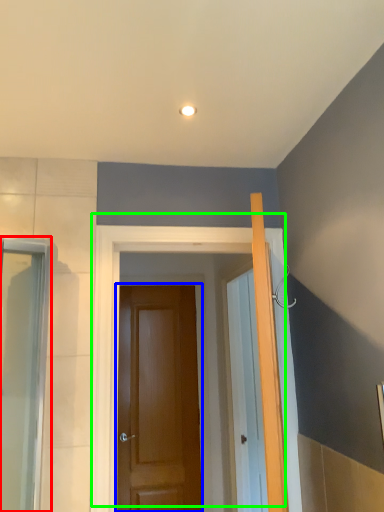
Question: Estimate the real-world distances between objects in this image. Which object is closer to screen door (highlighted by a red box), door (highlighted by a blue box) or door (highlighted by a green box)?

Choices:
 (A) door
 (B) door

Answer: (B)